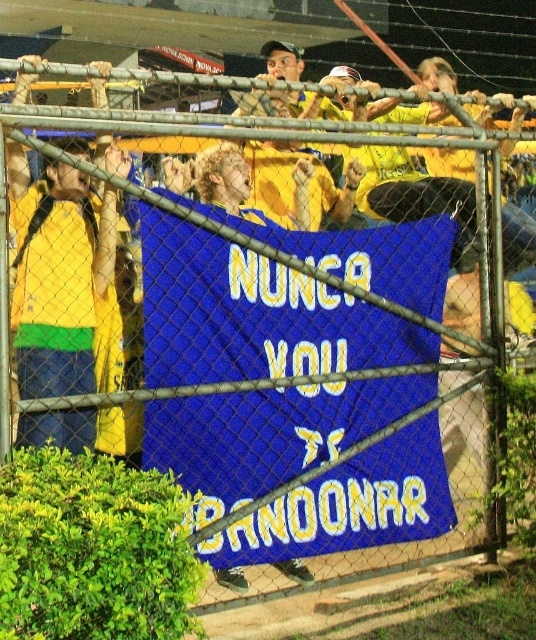
You are standing at the point with coordinates point [63,344] and want to move to the point with coordinates point [255,480]. Based on the scene description, will you have to go around the fence to reach your destination?

Point [255,480] is behind point [63,344], so you will have to go around the fence to reach your destination.

You are standing at the sports event and want to touch the blue banner hanging from the fence. The point you need to reach is marked as point (212, 547). Given that your arm can reach up to 2 meters, can you reach it?

The point (212, 547) is 6.37 meters from viewer. Since your arm can only reach up to 2 meters, you cannot reach it.